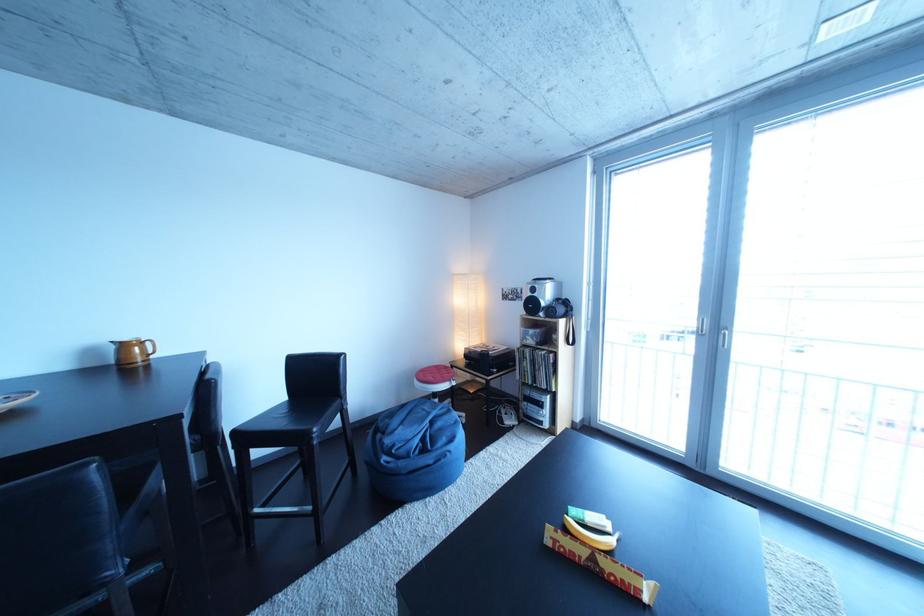
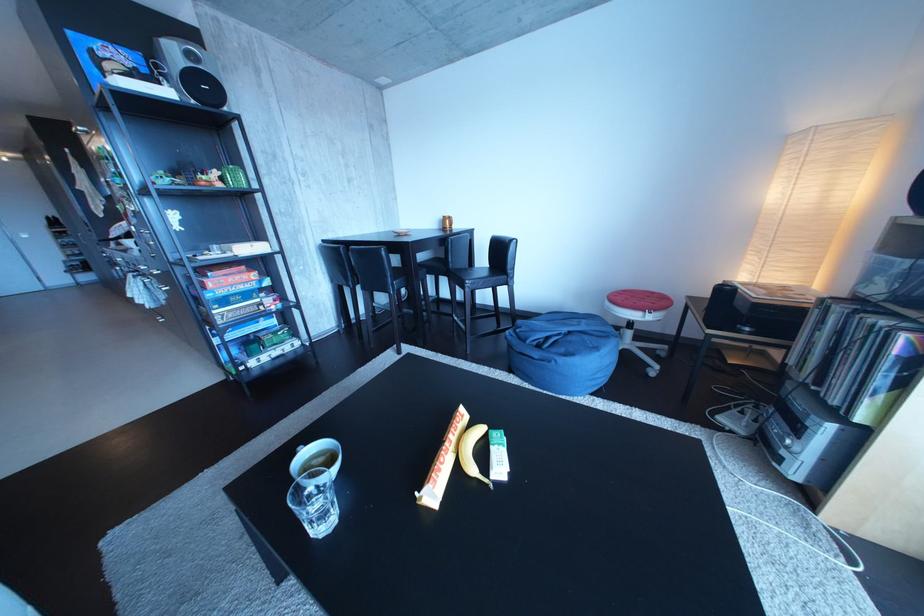
Where in the second image is the point corresponding to point (450, 371) from the first image?

(666, 299)